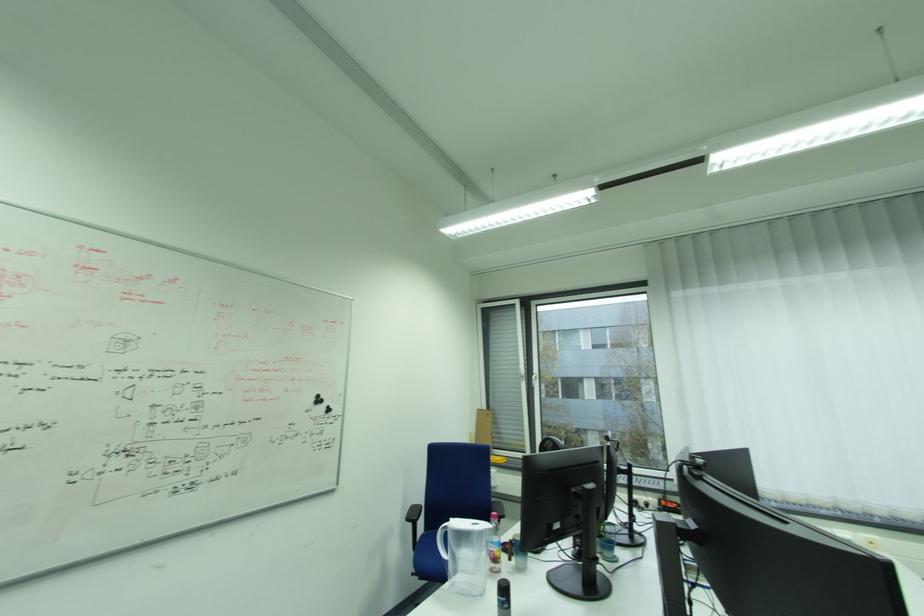
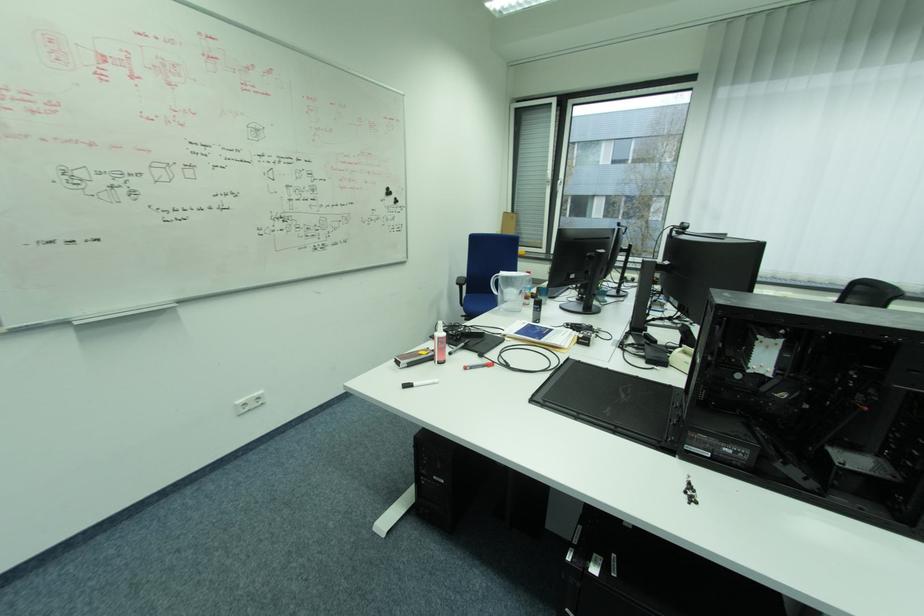
Find the pixel in the second image that matches point (321, 400) in the first image.

(392, 192)